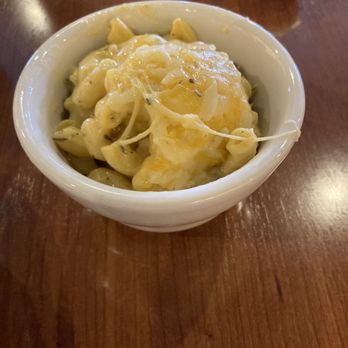
You are a GUI agent. You are given a task and a screenshot of the screen. Output one action in this format:
    pyautogui.click(x=<x>, y=<y>)
    Task: Click on the bowl
    
    Given the screenshot: What is the action you would take?
    pyautogui.click(x=189, y=208)